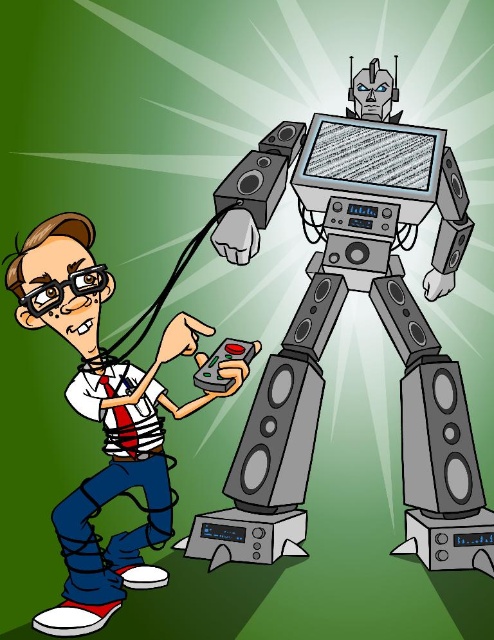
Describe the element at coordinates (105, 420) in the screenshot. I see `matte black shirt at left` at that location.

Can you confirm if matte black shirt at left is smaller than satin black speaker at center?

Actually, matte black shirt at left might be larger than satin black speaker at center.

Who is more distant from viewer, (70, 257) or (295, 364)?

Positioned behind is point (295, 364).

You are a GUI agent. You are given a task and a screenshot of the screen. Output one action in this format:
    pyautogui.click(x=<x>, y=<y>)
    Task: Click on the matte black shirt at left
    
    Given the screenshot: What is the action you would take?
    [105, 420]

Does point (70, 236) come in front of point (442, 369)?

Yes, it is in front of point (442, 369).

Is point (91, 221) positioned behind point (451, 413)?

Yes.

You are a GUI agent. You are given a task and a screenshot of the screen. Output one action in this format:
    pyautogui.click(x=<x>, y=<y>)
    Task: Click on the matte black shirt at left
    
    Given the screenshot: What is the action you would take?
    pyautogui.click(x=105, y=420)

Between satin black speaker at center and metallic gray speaker at lower right, which one has less height?

metallic gray speaker at lower right

Looking at this image, is satin black speaker at center shorter than metallic gray speaker at lower right?

In fact, satin black speaker at center may be taller than metallic gray speaker at lower right.

Measure the distance between satin black speaker at center and camera.

The distance of satin black speaker at center from camera is 1.67 meters.

Identify the location of satin black speaker at center. (278, 435).